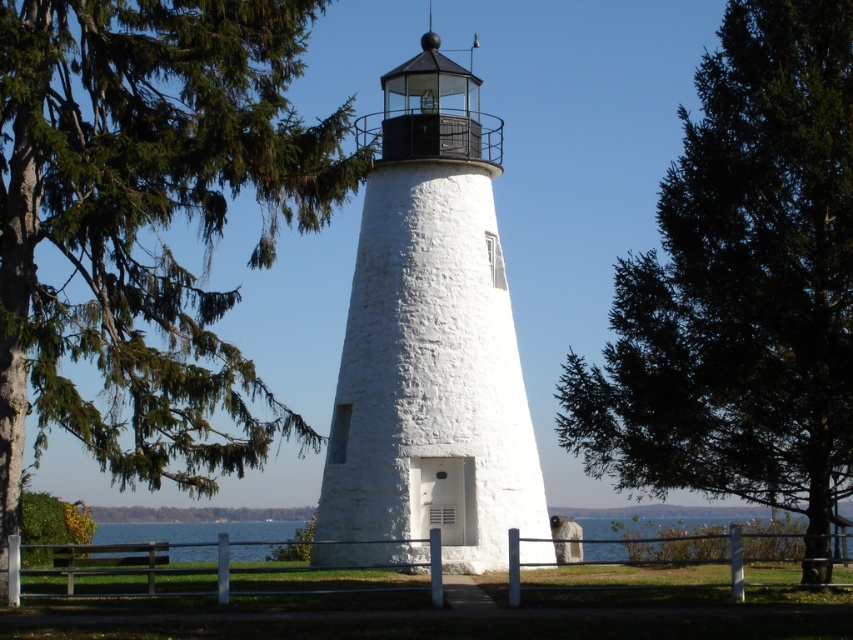
You are standing at the entrance of the lighthouse and looking towards the paved pathway. There is a point marked at coordinates point (x=428, y=342). Which object does this point correspond to?

The point at coordinates point (x=428, y=342) corresponds to the white stucco lighthouse at center.

You are a visitor approaching the lighthouse and notice the green leafy tree at upper left and the transparent water at lower center. Which object appears bigger in the scene?

The green leafy tree at upper left appears bigger in the scene compared to the transparent water at lower center as it has a larger size.

You are a painter standing at the base of the lighthouse, planning to paint the scene. You notice the green leafy tree at center and the transparent water at lower center. Which object has a narrower width in your painting?

The green leafy tree at center has a narrower width than the transparent water at lower center.